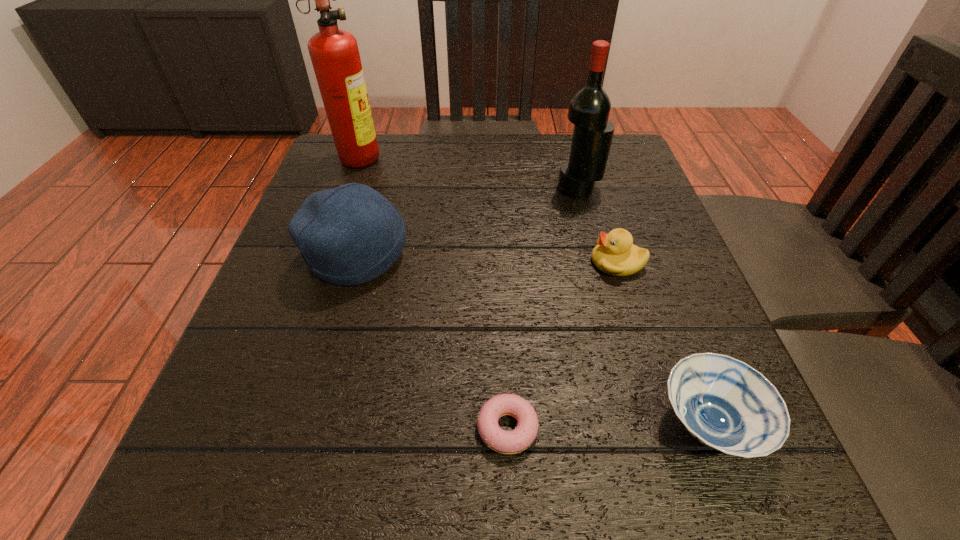
The height and width of the screenshot is (540, 960). I want to click on fire extinguisher, so click(x=334, y=53).

This screenshot has width=960, height=540. I want to click on the tallest object, so click(x=334, y=53).

Find the location of a particular element. The width and height of the screenshot is (960, 540). wine bottle is located at coordinates (589, 108).

You are a GUI agent. You are given a task and a screenshot of the screen. Output one action in this format:
    pyautogui.click(x=<x>, y=<y>)
    Task: Click on the second farthest object
    The width and height of the screenshot is (960, 540).
    Given the screenshot: What is the action you would take?
    pyautogui.click(x=589, y=108)

You are a GUI agent. You are given a task and a screenshot of the screen. Output one action in this format:
    pyautogui.click(x=<x>, y=<y>)
    Task: Click on the third tallest object
    The width and height of the screenshot is (960, 540).
    Given the screenshot: What is the action you would take?
    pyautogui.click(x=349, y=235)

Locate an element on the screen. Image resolution: width=960 pixels, height=540 pixels. duckling is located at coordinates (615, 254).

Image resolution: width=960 pixels, height=540 pixels. Identify the location of soup bowl. (724, 403).

Image resolution: width=960 pixels, height=540 pixels. I want to click on the shortest object, so click(506, 442).

Identify the location of the fourth object from right to left. (506, 442).

Identify the location of free region located 0.170m on the front-facing side of the tallest object. This screenshot has width=960, height=540. coord(449,156).